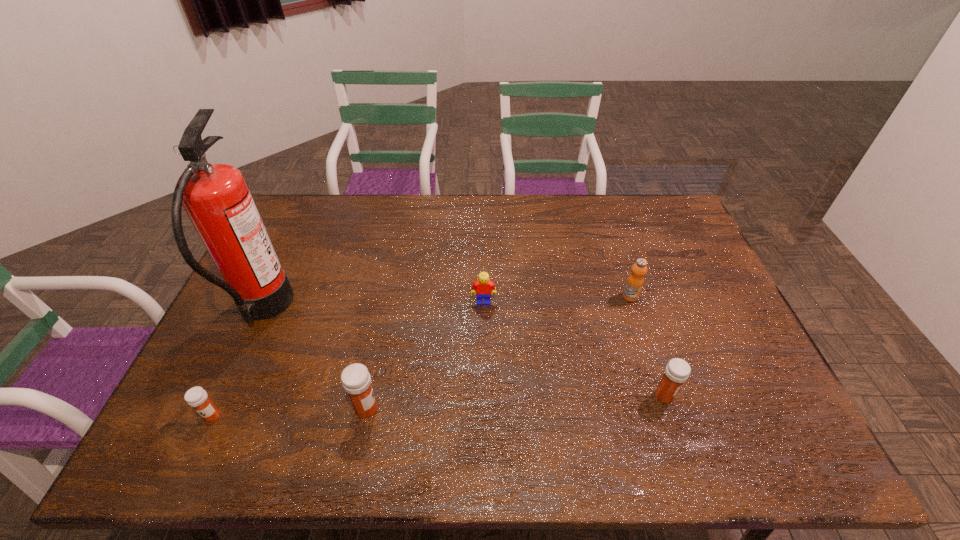
Where is `free region that satisfies the following two spatial constraints: 1. on the front label of the orange juice; 2. on the front-facing side of the tallest object`? This screenshot has width=960, height=540. free region that satisfies the following two spatial constraints: 1. on the front label of the orange juice; 2. on the front-facing side of the tallest object is located at coordinates (635, 310).

Find the location of a particular element. Image resolution: width=960 pixels, height=540 pixels. free point that satisfies the following two spatial constraints: 1. on the front label of the orange juice; 2. on the label side of the second medicine from left to right is located at coordinates (667, 409).

Where is `vacant area that satisfies the following two spatial constraints: 1. on the front-facing side of the Lego; 2. on the label side of the tallest medicine`? vacant area that satisfies the following two spatial constraints: 1. on the front-facing side of the Lego; 2. on the label side of the tallest medicine is located at coordinates pyautogui.click(x=485, y=409).